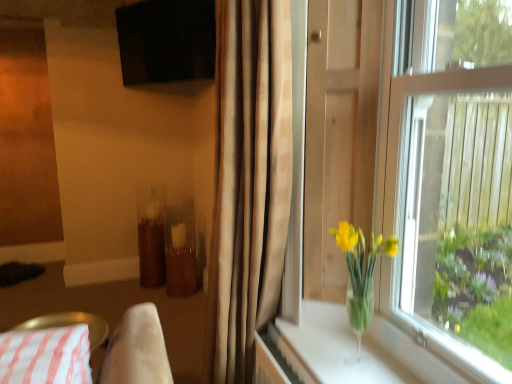
Question: From the image's perspective, is black matte screen at upper center, arranged as the 1th window screen when viewed from the back, under white striped fabric at lower left?

Choices:
 (A) no
 (B) yes

Answer: (A)

Question: Is black matte screen at upper center, arranged as the 1th window screen when viewed from the left, bigger than white striped fabric at lower left?

Choices:
 (A) no
 (B) yes

Answer: (A)

Question: Is black matte screen at upper center, arranged as the 1th window screen when viewed from the back, in contact with white striped fabric at lower left?

Choices:
 (A) no
 (B) yes

Answer: (A)

Question: Is black matte screen at upper center, the first window screen positioned from the top, facing away from white striped fabric at lower left?

Choices:
 (A) no
 (B) yes

Answer: (A)

Question: Is black matte screen at upper center, arranged as the 1th window screen when viewed from the left, closer to camera compared to white striped fabric at lower left?

Choices:
 (A) yes
 (B) no

Answer: (B)

Question: Considering the positions of point (404, 31) and point (361, 271), is point (404, 31) closer or farther from the camera than point (361, 271)?

Choices:
 (A) farther
 (B) closer

Answer: (B)

Question: Is transparent glass vase at right, which appears as the 1th window screen when ordered from the bottom, bigger or smaller than translucent glass vase at window?

Choices:
 (A) big
 (B) small

Answer: (A)

Question: From a real-world perspective, is transparent glass vase at right, which appears as the 1th window screen when ordered from the bottom, positioned above or below translucent glass vase at window?

Choices:
 (A) above
 (B) below

Answer: (A)

Question: Is transparent glass vase at right, arranged as the second window screen when viewed from the back, taller or shorter than translucent glass vase at window?

Choices:
 (A) tall
 (B) short

Answer: (A)

Question: From a real-world perspective, relative to clear glass vase at lower right, is white striped fabric at lower left vertically above or below?

Choices:
 (A) below
 (B) above

Answer: (A)

Question: Is point (110, 369) positioned closer to the camera than point (327, 322)?

Choices:
 (A) closer
 (B) farther

Answer: (A)

Question: Is white striped fabric at lower left in front of or behind clear glass vase at lower right in the image?

Choices:
 (A) front
 (B) behind

Answer: (B)

Question: From their relative heights in the image, would you say white striped fabric at lower left is taller or shorter than clear glass vase at lower right?

Choices:
 (A) tall
 (B) short

Answer: (A)

Question: Considering the positions of beige fabric curtain at center and transparent glass vase at right, arranged as the second window screen when viewed from the back, in the image, is beige fabric curtain at center bigger or smaller than transparent glass vase at right, arranged as the second window screen when viewed from the back,?

Choices:
 (A) small
 (B) big

Answer: (B)

Question: Is point (264, 258) closer or farther from the camera than point (476, 261)?

Choices:
 (A) closer
 (B) farther

Answer: (A)